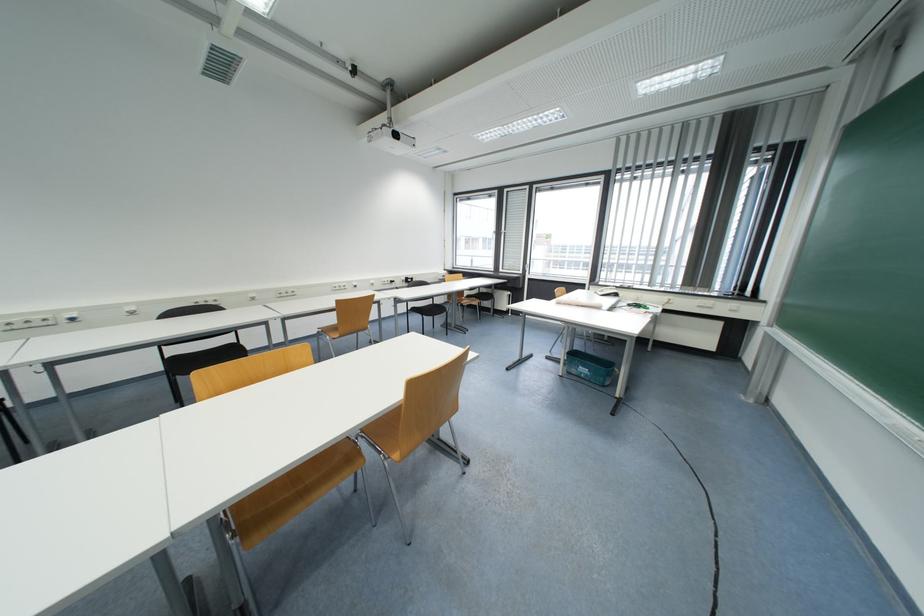
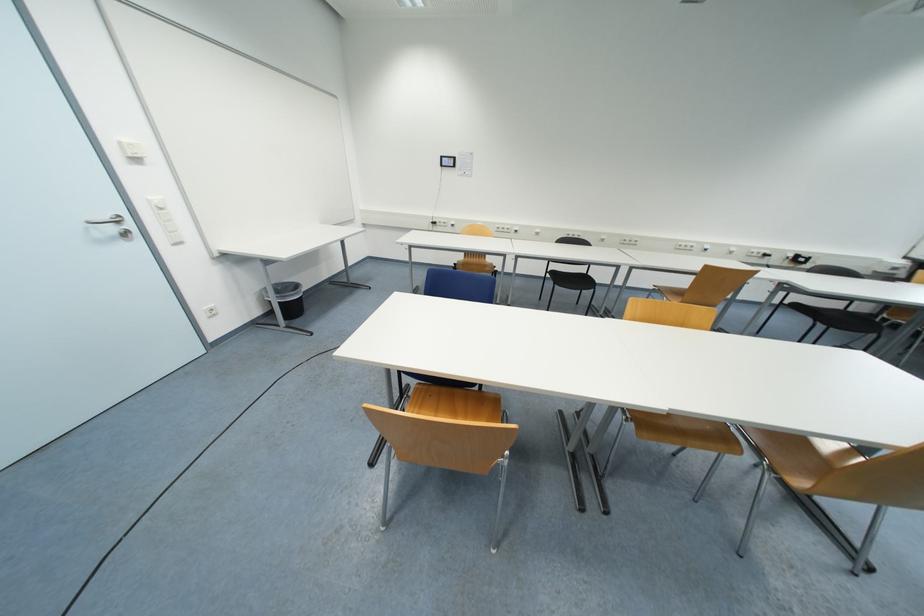
The point at (237, 538) is marked in the first image. Where is the corresponding point in the second image?

(631, 422)